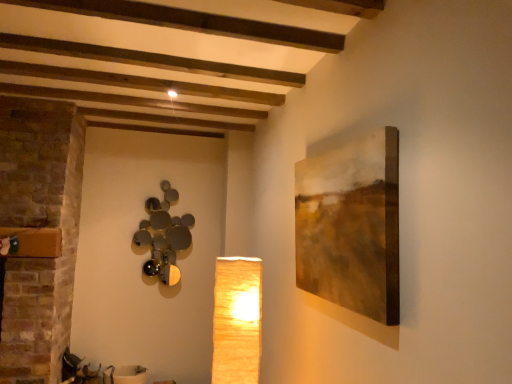
Question: Is matte yellow paper lampshade at center, positioned as the 1th lamp in front-to-back order, in front of or behind matte brown canvas at right in the image?

Choices:
 (A) front
 (B) behind

Answer: (B)

Question: In the image, is matte yellow paper lampshade at center, marked as the 2th lamp in a back-to-front arrangement, on the left side or the right side of matte brown canvas at right?

Choices:
 (A) left
 (B) right

Answer: (A)

Question: Estimate the real-world distances between objects in this image. Which object is farther from the matte yellow paper lampshade at center, marked as the 2th lamp in a back-to-front arrangement?

Choices:
 (A) matte brown canvas at right
 (B) metallic reflective spheres at upper left, positioned as the 1th lamp in left-to-right order

Answer: (B)

Question: Estimate the real-world distances between objects in this image. Which object is closer to the metallic reflective spheres at upper left, which ranks as the 1th lamp in back-to-front order?

Choices:
 (A) matte yellow paper lampshade at center, the second lamp viewed from the left
 (B) matte brown canvas at right

Answer: (A)